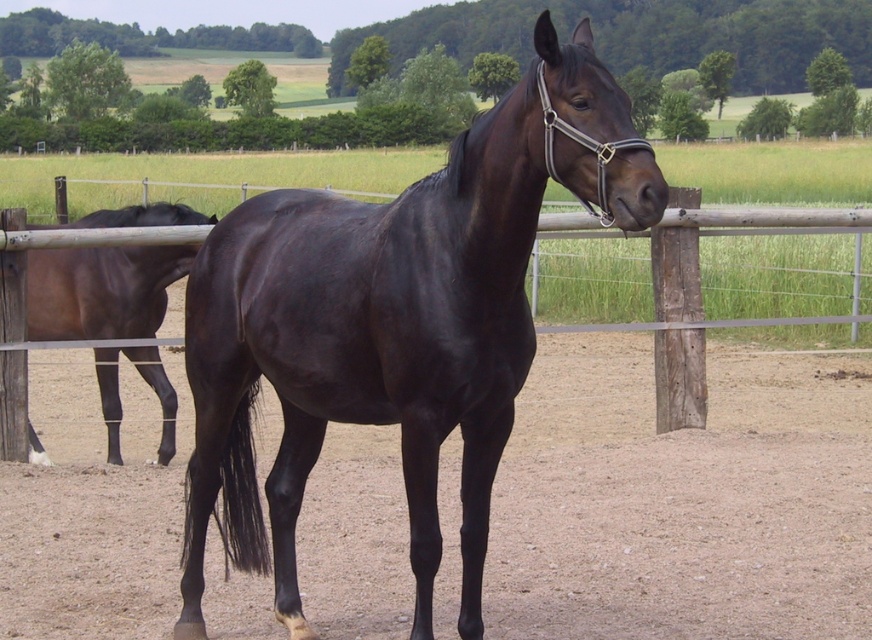
Can you confirm if shiny black horse at center is positioned to the left of brown glossy horse at left?

No, shiny black horse at center is not to the left of brown glossy horse at left.

Locate an element on the screen. This screenshot has height=640, width=872. shiny black horse at center is located at coordinates (394, 323).

Is dirt at center closer to camera compared to wooden post at center?

No, it is behind wooden post at center.

Is point (109, 528) positioned after point (90, 339)?

No, it is in front of (90, 339).

I want to click on dirt at center, so click(x=683, y=499).

Locate an element on the screen. dirt at center is located at coordinates (683, 499).

Does point (43, 417) come closer to viewer compared to point (612, 108)?

No, it is behind (612, 108).

Which is in front, point (28, 589) or point (513, 90)?

Point (513, 90) is more forward.

The height and width of the screenshot is (640, 872). What are the coordinates of `dirt at center` in the screenshot? It's located at (683, 499).